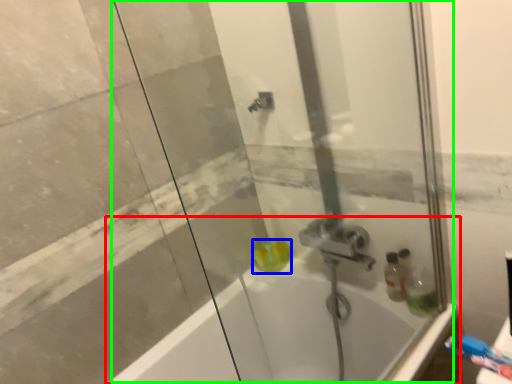
Question: Considering the real-world distances, which object is farthest from bathtub (highlighted by a red box)? liquid (highlighted by a blue box) or shower door (highlighted by a green box)?

Choices:
 (A) liquid
 (B) shower door

Answer: (B)